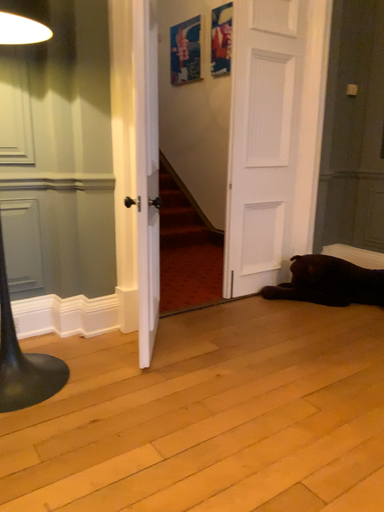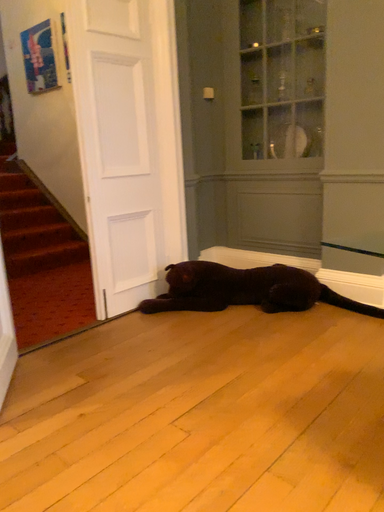
Question: Which way did the camera rotate in the video?

Choices:
 (A) rotated right
 (B) rotated left

Answer: (A)